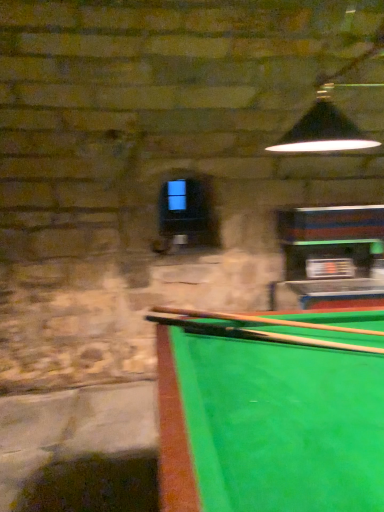
Find the location of a particular element. free point above wooden cue at lower right, which is counted as the first cue, starting from the bottom (from a real-world perspective) is located at coordinates (292, 333).